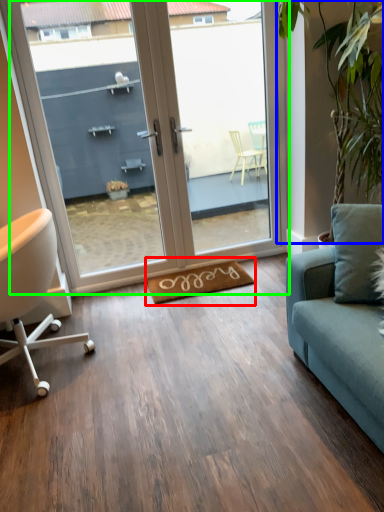
Question: Considering the real-world distances, which object is closest to yoga mat (highlighted by a red box)? plant (highlighted by a blue box) or door (highlighted by a green box).

Choices:
 (A) plant
 (B) door

Answer: (B)